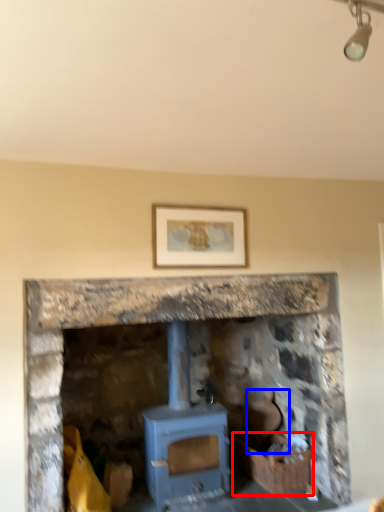
Question: Which object appears closest to the camera in this image, crate (highlighted by a red box) or chair (highlighted by a blue box)?

Choices:
 (A) crate
 (B) chair

Answer: (A)